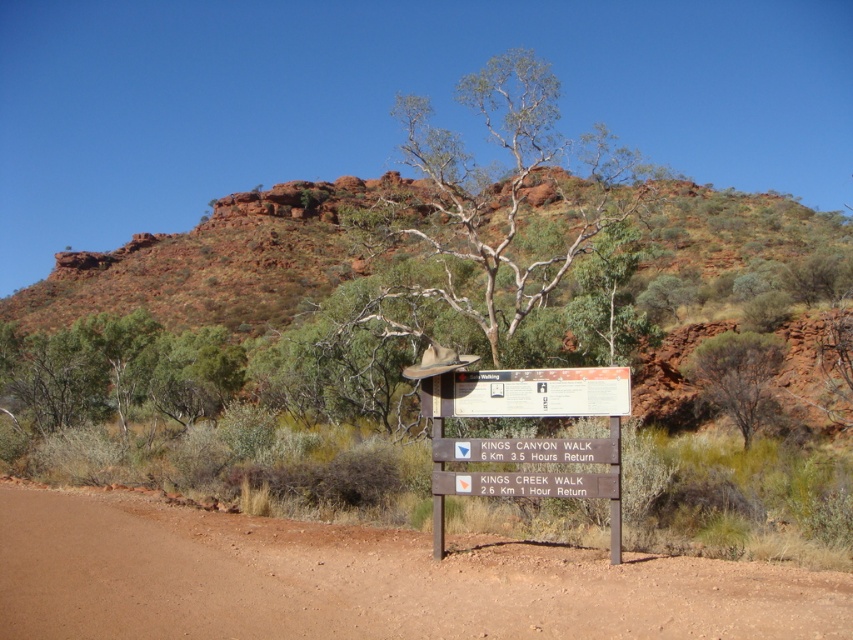
Question: Which of the following is the farthest from the observer?

Choices:
 (A) wooden sign at center
 (B) green leafy tree at center

Answer: (B)

Question: Can you confirm if reddish-brown rock at center is positioned to the left of wooden signboard at center?

Choices:
 (A) yes
 (B) no

Answer: (B)

Question: Observing the image, what is the correct spatial positioning of brown dirt track at center in reference to wooden sign at center?

Choices:
 (A) above
 (B) below

Answer: (B)

Question: Which of the following is the closest to the observer?

Choices:
 (A) wooden signboard at center
 (B) brown dirt track at center
 (C) green leafy tree at center

Answer: (B)

Question: Can you confirm if wooden sign at center is positioned below wooden signboard at center?

Choices:
 (A) yes
 (B) no

Answer: (A)

Question: Among these objects, which one is nearest to the camera?

Choices:
 (A) reddish-brown rock at center
 (B) wooden signboard at center
 (C) green leafy tree at center
 (D) green leafy shrub at left

Answer: (B)